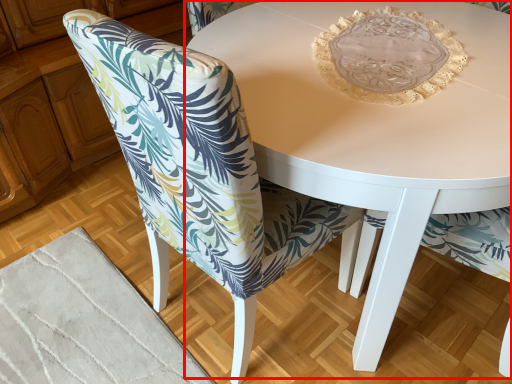
Question: Where is coffee table (annotated by the red box) located in relation to chair in the image?

Choices:
 (A) right
 (B) left

Answer: (A)